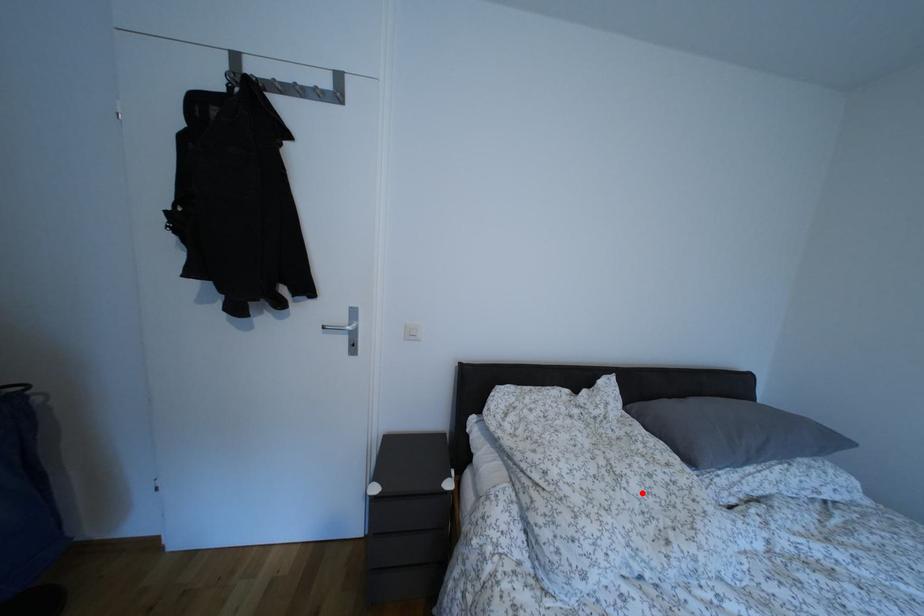
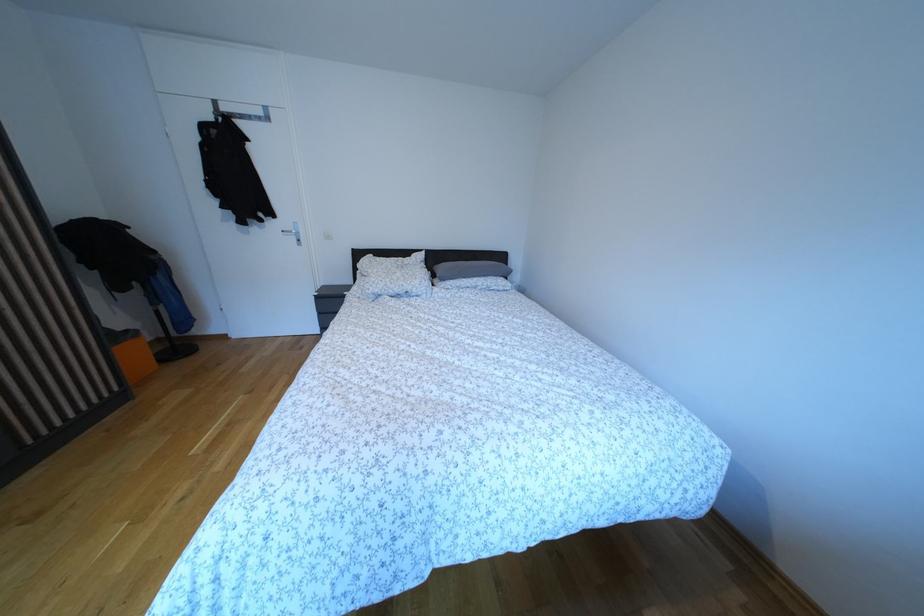
Find the pixel in the second image that matches the highlighted location in the first image.

(406, 281)